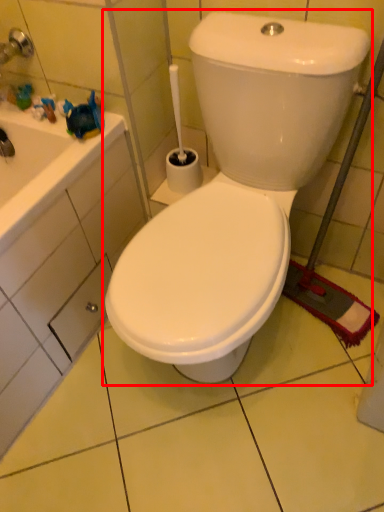
Question: From the image's perspective, what is the correct spatial relationship of toilet (annotated by the red box) in relation to drawer?

Choices:
 (A) below
 (B) above

Answer: (B)